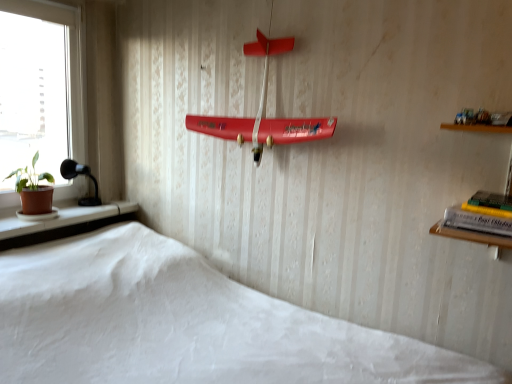
Question: Can you confirm if terracotta clay pot at left is positioned to the left of green matte houseplant at left?

Choices:
 (A) yes
 (B) no

Answer: (B)

Question: Does terracotta clay pot at left appear on the right side of green matte houseplant at left?

Choices:
 (A) yes
 (B) no

Answer: (A)

Question: Is terracotta clay pot at left shorter than green matte houseplant at left?

Choices:
 (A) no
 (B) yes

Answer: (B)

Question: Can you confirm if terracotta clay pot at left is taller than green matte houseplant at left?

Choices:
 (A) yes
 (B) no

Answer: (B)

Question: Is terracotta clay pot at left touching green matte houseplant at left?

Choices:
 (A) no
 (B) yes

Answer: (A)

Question: Based on their sizes in the image, would you say black glass lamp at left is bigger or smaller than white matte bed at lower center?

Choices:
 (A) big
 (B) small

Answer: (B)

Question: Considering the positions of point (99, 200) and point (413, 362), is point (99, 200) closer or farther from the camera than point (413, 362)?

Choices:
 (A) farther
 (B) closer

Answer: (A)

Question: Is black glass lamp at left spatially inside white matte bed at lower center, or outside of it?

Choices:
 (A) inside
 (B) outside

Answer: (B)

Question: Visually, is black glass lamp at left positioned to the left or to the right of white matte bed at lower center?

Choices:
 (A) left
 (B) right

Answer: (A)

Question: Based on their sizes in the image, would you say white matte bed at lower center is bigger or smaller than terracotta clay pot at left?

Choices:
 (A) small
 (B) big

Answer: (B)

Question: Looking at their shapes, would you say white matte bed at lower center is wider or thinner than terracotta clay pot at left?

Choices:
 (A) thin
 (B) wide

Answer: (B)

Question: In the image, is white matte bed at lower center on the left side or the right side of terracotta clay pot at left?

Choices:
 (A) left
 (B) right

Answer: (B)

Question: Is white matte bed at lower center taller or shorter than terracotta clay pot at left?

Choices:
 (A) short
 (B) tall

Answer: (B)

Question: Is hardcover book at right wider or thinner than black glass lamp at left?

Choices:
 (A) thin
 (B) wide

Answer: (B)

Question: In the image, is hardcover book at right positioned in front of or behind black glass lamp at left?

Choices:
 (A) behind
 (B) front

Answer: (B)